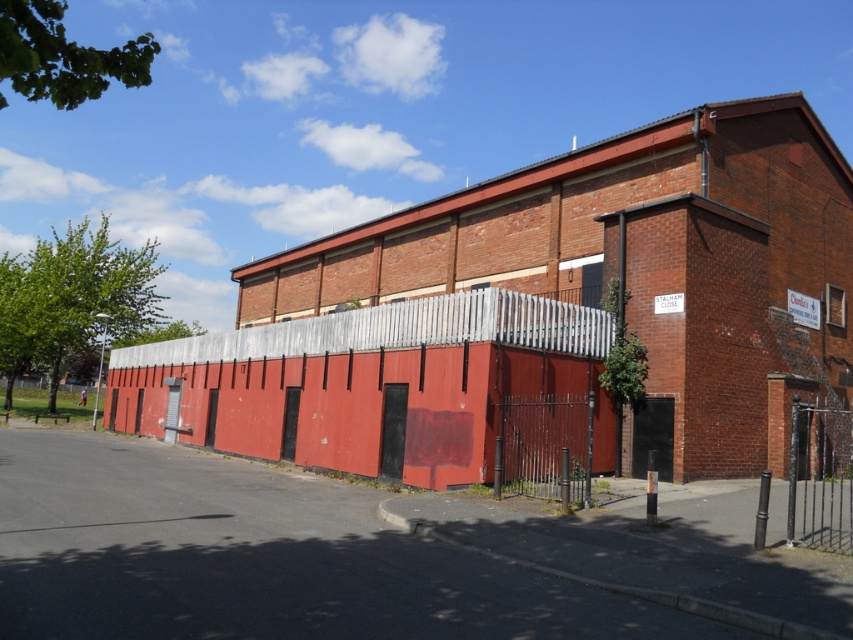
You are standing on the sidewalk to the left of the large brick building. You see a point marked at coordinates (x=367, y=381). What does this point indicate?

The point at (x=367, y=381) indicates the location of the smooth red fence at center.

You are a delivery person trying to enter the building through the gate. Based on the scene, can you determine if the black wrought iron gate at center is taller than the black wrought iron fence at right?

The black wrought iron gate at center is not as tall as the black wrought iron fence at right, so the fence is taller than the gate.